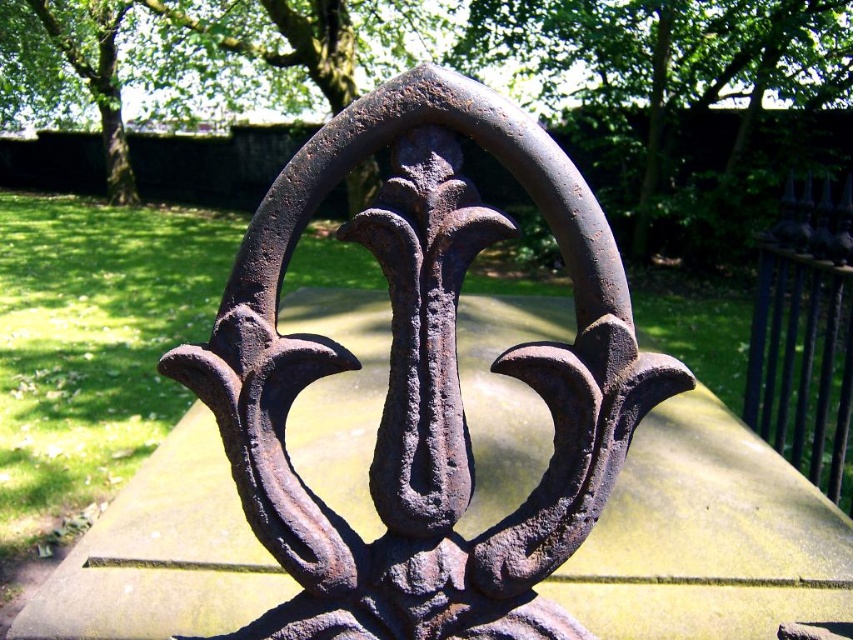
Does rusty metal sculpture at center have a lesser height compared to glossy black fence at upper right?

Indeed, rusty metal sculpture at center has a lesser height compared to glossy black fence at upper right.

Is point (396, 346) farther from camera compared to point (798, 460)?

No, it is in front of (798, 460).

At what (x,y) coordinates should I click in order to perform the action: click on rusty metal sculpture at center. Please return your answer as a coordinate pair (x, y). Looking at the image, I should click on (424, 380).